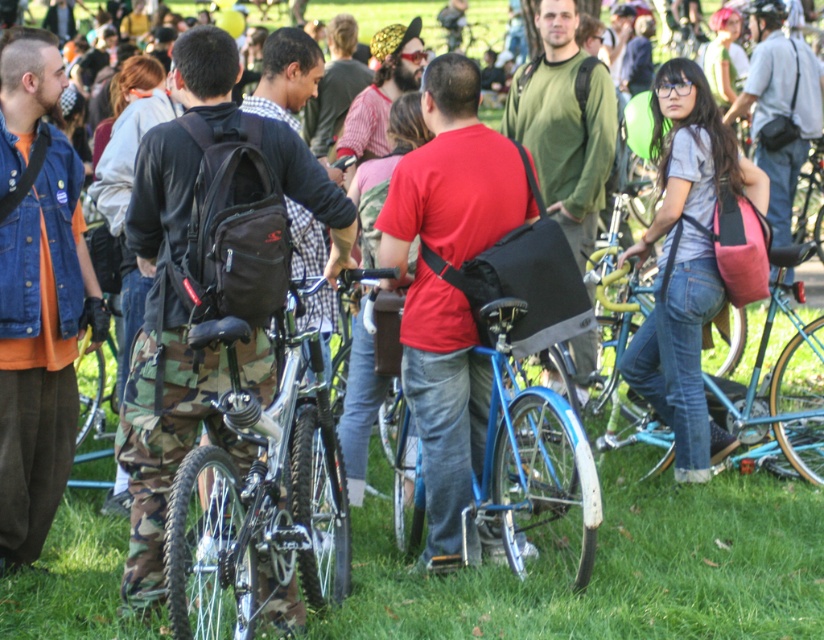
Question: Which of the following is the closest to the observer?

Choices:
 (A) [x=281, y=346]
 (B) [x=756, y=522]

Answer: (A)

Question: Does green grass at center appear on the left side of blue metallic bicycle at center?

Choices:
 (A) yes
 (B) no

Answer: (B)

Question: Can you confirm if green grass at center is thinner than blue metallic bicycle at center?

Choices:
 (A) yes
 (B) no

Answer: (B)

Question: Considering the real-world distances, which object is closest to the shiny metallic bicycle at center?

Choices:
 (A) denim jeans at center
 (B) shiny black bicycle at center

Answer: (B)

Question: Which of the following is the closest to the observer?

Choices:
 (A) (91, 417)
 (B) (228, 515)
 (C) (515, 301)
 (D) (644, 390)

Answer: (B)

Question: Observing the image, what is the correct spatial positioning of blue metallic bicycle at center in reference to teal matte bicycle at center?

Choices:
 (A) above
 (B) below

Answer: (B)